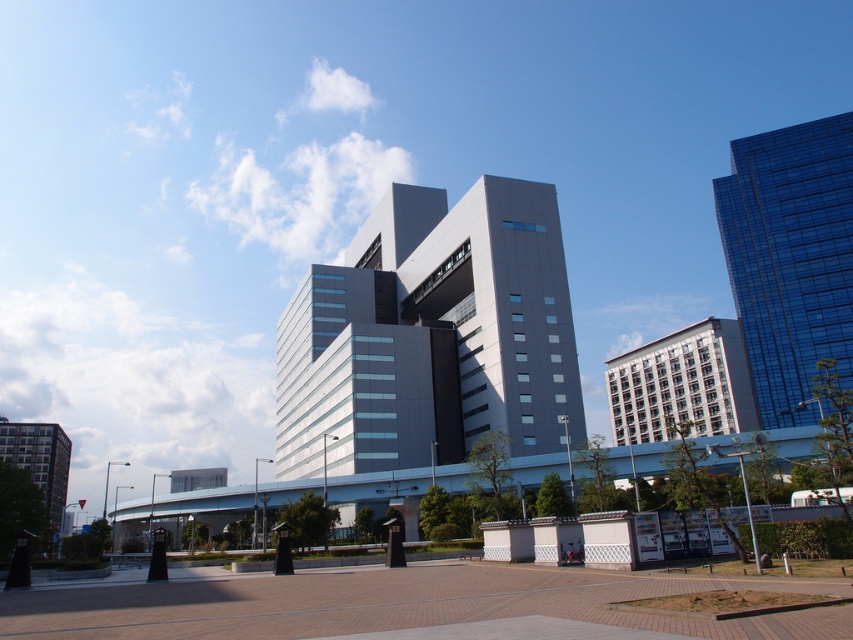
Which is more to the left, shiny glass building at upper right or matte gray building at lower left?

From the viewer's perspective, matte gray building at lower left appears more on the left side.

Describe the element at coordinates (790, 259) in the screenshot. I see `shiny glass building at upper right` at that location.

The width and height of the screenshot is (853, 640). What do you see at coordinates (790, 259) in the screenshot?
I see `shiny glass building at upper right` at bounding box center [790, 259].

Where is `shiny glass building at upper right`? This screenshot has height=640, width=853. shiny glass building at upper right is located at coordinates (790, 259).

Which is below, sleek gray building at center or matte gray building at lower left?

matte gray building at lower left is lower down.

Locate an element on the screen. sleek gray building at center is located at coordinates (431, 336).

Who is more distant from viewer, (463, 308) or (845, 128)?

Point (845, 128)

Which is below, sleek gray building at center or shiny glass building at upper right?

sleek gray building at center is below.

Does point (512, 448) lie in front of point (851, 189)?

Yes, it is in front of point (851, 189).

You are a GUI agent. You are given a task and a screenshot of the screen. Output one action in this format:
    pyautogui.click(x=<x>, y=<y>)
    Task: Click on the sleek gray building at center
    
    Given the screenshot: What is the action you would take?
    pyautogui.click(x=431, y=336)